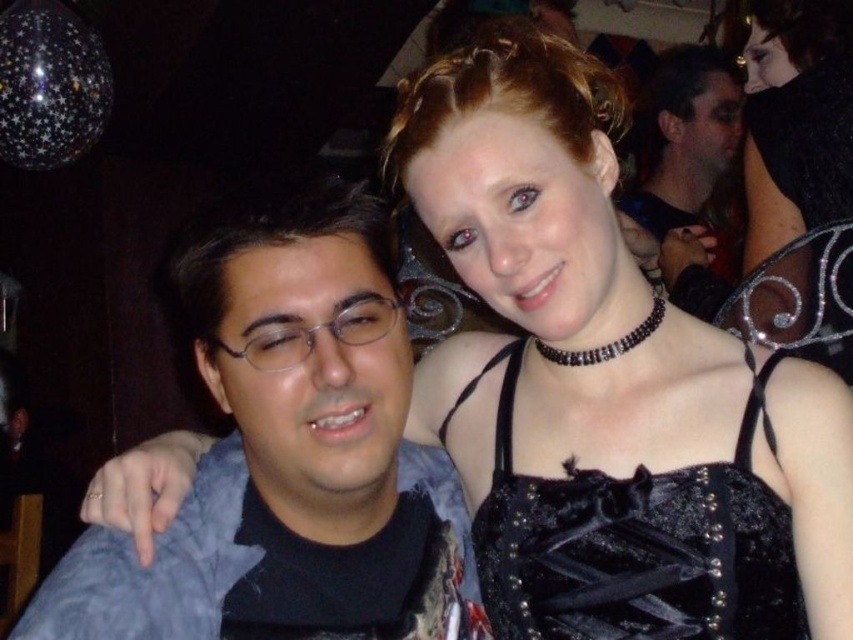
Which is in front, point (375, 380) or point (666, 84)?

Point (375, 380) is in front.

Between point (338, 548) and point (676, 97), which one is positioned in front?

Positioned in front is point (338, 548).

Find the location of a particular element. The height and width of the screenshot is (640, 853). blue fabric shirt at left is located at coordinates (x=288, y=454).

Which of these two, blue fabric shirt at left or black velvet dress at center, stands shorter?

black velvet dress at center

Does blue fabric shirt at left come in front of black velvet dress at center?

Yes, blue fabric shirt at left is in front of black velvet dress at center.

Does point (379, 362) come closer to viewer compared to point (720, 516)?

Yes.

Identify the location of blue fabric shirt at left. (288, 454).

Between point (328, 529) and point (770, 68), which one is positioned behind?

Positioned behind is point (770, 68).

Does blue fabric shirt at left have a greater height compared to black velvet dress at upper right?

Incorrect, blue fabric shirt at left's height is not larger of black velvet dress at upper right's.

Image resolution: width=853 pixels, height=640 pixels. Describe the element at coordinates (288, 454) in the screenshot. I see `blue fabric shirt at left` at that location.

In order to click on blue fabric shirt at left in this screenshot , I will do `click(288, 454)`.